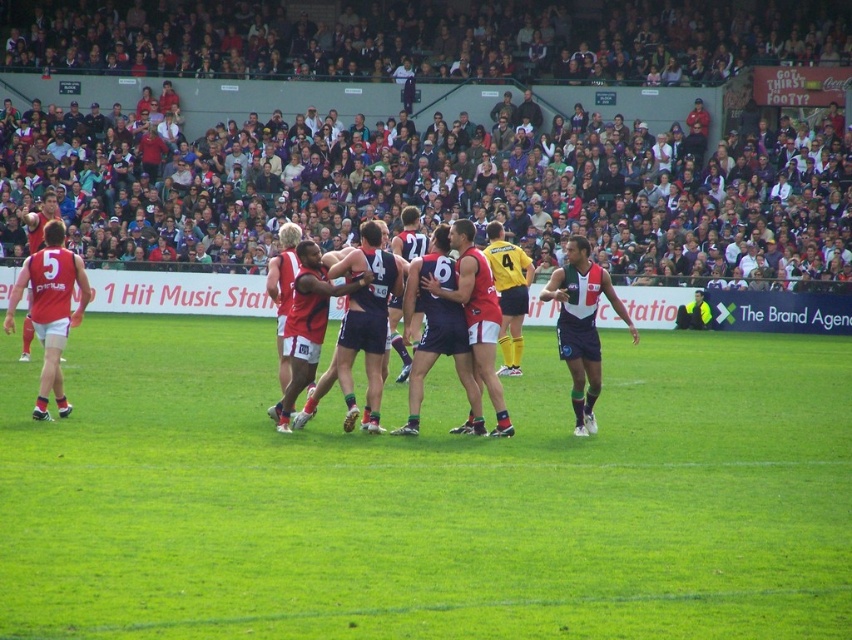
Based on the scene description, if you were standing on the field facing the action, which object would appear higher in your field of view between the dark blue jersey at right and the matte red singlet at left?

The dark blue jersey at right appears higher in the field of view because it is positioned above the matte red singlet at left.

Based on the scene, can you tell me what is located at the coordinates point (438, 131)?

At point (438, 131) lies dark gray crowd at upper center.